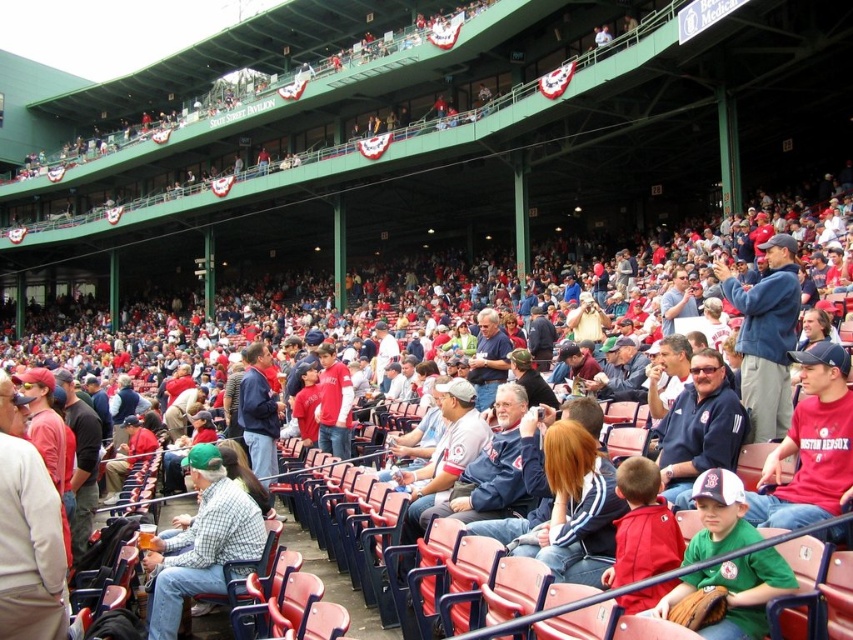
Question: Is checkered fabric shirt at center thinner than green jersey at center?

Choices:
 (A) no
 (B) yes

Answer: (A)

Question: Is checkered fabric shirt at center in front of green jersey at center?

Choices:
 (A) no
 (B) yes

Answer: (A)

Question: Is the position of checkered fabric shirt at center more distant than that of green jersey at center?

Choices:
 (A) no
 (B) yes

Answer: (B)

Question: Which point appears closest to the camera in this image?

Choices:
 (A) (688, 554)
 (B) (172, 544)

Answer: (A)

Question: Which point is farther from the camera taking this photo?

Choices:
 (A) (792, 573)
 (B) (154, 545)

Answer: (B)